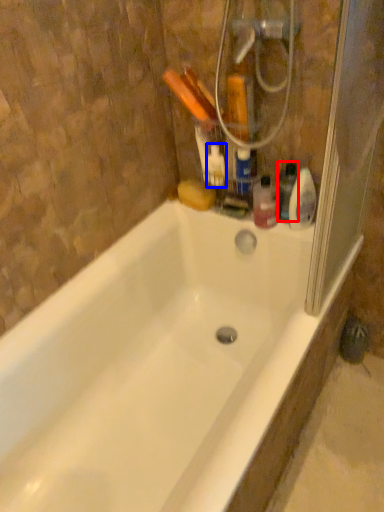
Question: Among these objects, which one is nearest to the camera, cleaning product (highlighted by a red box) or cleaning product (highlighted by a blue box)?

Choices:
 (A) cleaning product
 (B) cleaning product

Answer: (A)